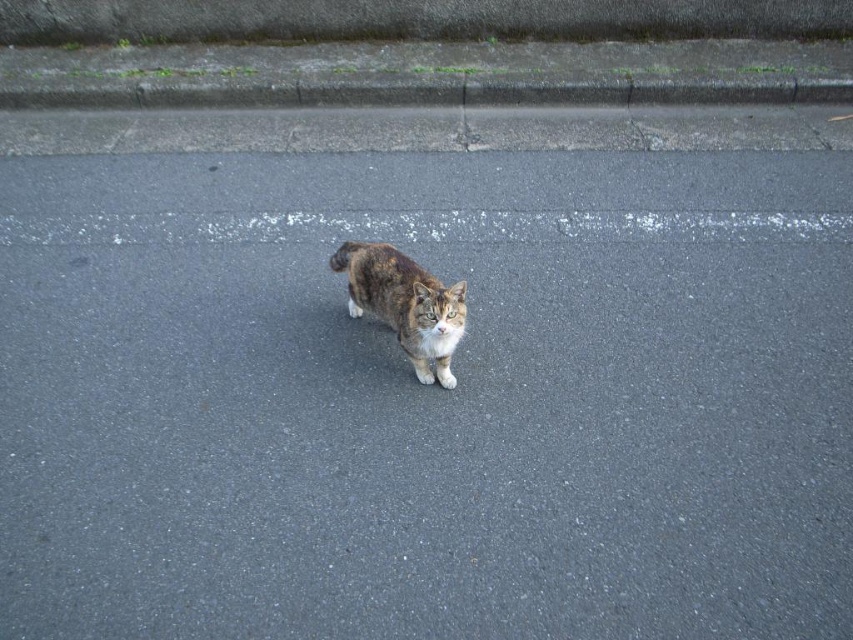
You are a delivery drone flying above the road. You need to land on the gray concrete curb at upper center to drop off a package. However, the tabby fur cat at center is currently blocking the landing zone. Can the drone safely land on the curb without disturbing the cat?

The gray concrete curb at upper center is not as tall as the tabby fur cat at center, so the drone can safely land on the curb since it is shorter than the cat and the cat might not notice the landing.

You are a delivery robot that is 1.2 meters tall. You are approaching the gray concrete curb at upper center in the image. Can you safely go over it?

The gray concrete curb at upper center is 5.09 meters away from the viewer, so the delivery robot can safely approach and go over it as the distance is sufficient for navigation.

You are a delivery person trying to place a small box on the gray concrete curb at upper center. The box is as wide as the tabby fur cat at center. Will the box fit on the curb?

The gray concrete curb at upper center might be wider than the tabby fur cat at center, so the box, which is as wide as the cat, should fit on the curb.